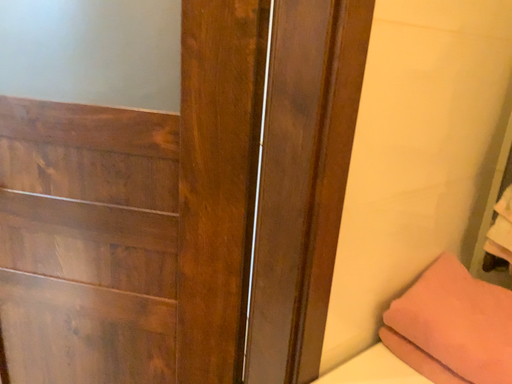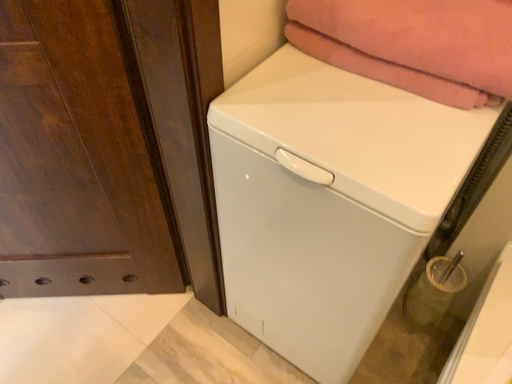
Question: How did the camera likely rotate when shooting the video?

Choices:
 (A) rotated downward
 (B) rotated upward

Answer: (A)